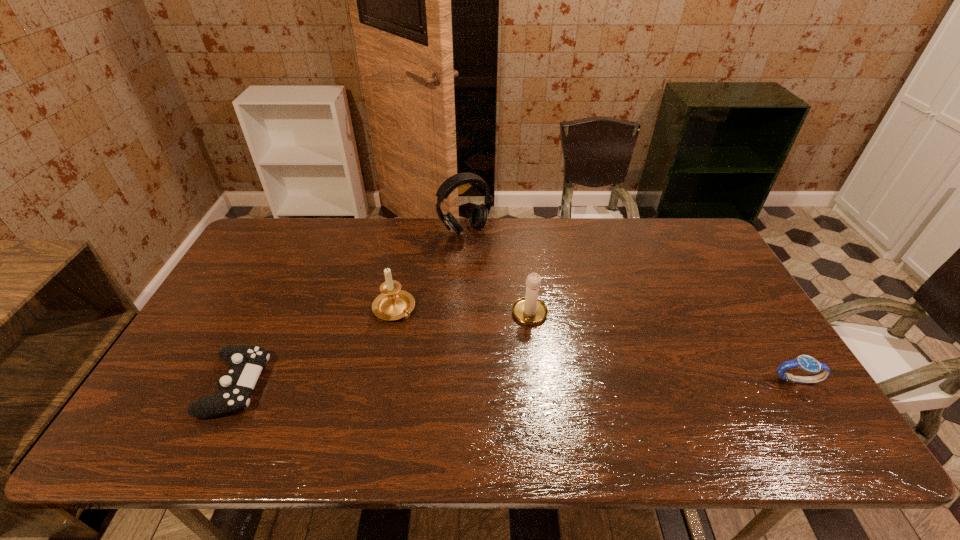
This screenshot has width=960, height=540. What are the coordinates of `object that is at the left edge` in the screenshot? It's located at (246, 362).

At what (x,y) coordinates should I click in order to perform the action: click on object present at the right edge. Please return your answer as a coordinate pair (x, y). Looking at the image, I should click on (806, 363).

The height and width of the screenshot is (540, 960). In order to click on object that is at the near left corner in this screenshot , I will do `click(246, 362)`.

You are a GUI agent. You are given a task and a screenshot of the screen. Output one action in this format:
    pyautogui.click(x=<x>, y=<y>)
    Task: Click on the object that is at the near right corner
    The image size is (960, 540).
    Given the screenshot: What is the action you would take?
    point(806,363)

In the image, there is a desktop. Where is `vacant space at the far edge`? vacant space at the far edge is located at coordinates (410, 245).

Identify the location of vacant space at the near edge of the desktop. Image resolution: width=960 pixels, height=540 pixels. (395, 381).

Locate an element on the screen. The width and height of the screenshot is (960, 540). vacant position at the left edge of the desktop is located at coordinates (274, 278).

This screenshot has height=540, width=960. I want to click on vacant space at the right edge of the desktop, so click(x=709, y=285).

The height and width of the screenshot is (540, 960). What are the coordinates of `vacant position at the far right corner of the desktop` in the screenshot? It's located at (693, 235).

At what (x,y) coordinates should I click in order to perform the action: click on free space between the right candle holder and the leftmost object. Please return your answer as a coordinate pair (x, y). The height and width of the screenshot is (540, 960). Looking at the image, I should click on (383, 350).